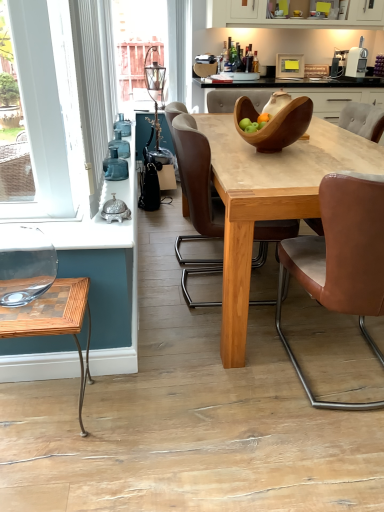
Question: Is white textured curtain at left thinner than brown leather chair at center, which ranks as the 3th chair in right-to-left order?

Choices:
 (A) no
 (B) yes

Answer: (B)

Question: Considering the relative sizes of white textured curtain at left and brown leather chair at center, placed as the 1th chair when sorted from left to right, in the image provided, is white textured curtain at left bigger than brown leather chair at center, placed as the 1th chair when sorted from left to right,?

Choices:
 (A) yes
 (B) no

Answer: (B)

Question: Is white textured curtain at left outside of brown leather chair at center, which ranks as the 3th chair in right-to-left order?

Choices:
 (A) yes
 (B) no

Answer: (A)

Question: Is white textured curtain at left placed right next to brown leather chair at center, which ranks as the 3th chair in right-to-left order?

Choices:
 (A) yes
 (B) no

Answer: (B)

Question: Is white textured curtain at left taller than brown leather chair at center, placed as the 1th chair when sorted from left to right?

Choices:
 (A) yes
 (B) no

Answer: (A)

Question: Can you confirm if white textured curtain at left is wider than brown leather chair at center, which ranks as the 3th chair in right-to-left order?

Choices:
 (A) no
 (B) yes

Answer: (A)

Question: Is wooden bowl at center not inside white plastic toaster at upper right?

Choices:
 (A) no
 (B) yes

Answer: (B)

Question: Is wooden bowl at center facing towards white plastic toaster at upper right?

Choices:
 (A) yes
 (B) no

Answer: (B)

Question: Are wooden bowl at center and white plastic toaster at upper right far apart?

Choices:
 (A) no
 (B) yes

Answer: (A)

Question: Is wooden bowl at center placed right next to white plastic toaster at upper right?

Choices:
 (A) no
 (B) yes

Answer: (A)

Question: Would you say white plastic toaster at upper right is part of wooden bowl at center's contents?

Choices:
 (A) yes
 (B) no

Answer: (A)

Question: From a real-world perspective, is wooden bowl at center positioned over white plastic toaster at upper right based on gravity?

Choices:
 (A) yes
 (B) no

Answer: (B)

Question: From the image's perspective, would you say natural wood table at center is shown under wooden checkered coffee table at lower left?

Choices:
 (A) yes
 (B) no

Answer: (B)